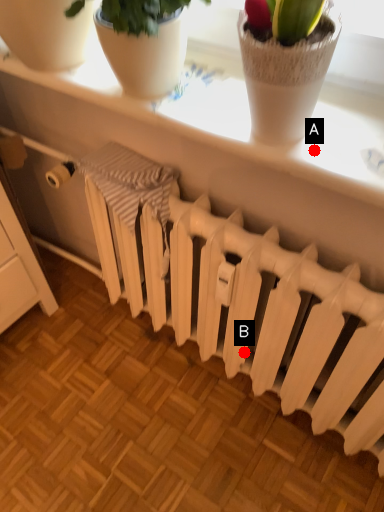
Question: Two points are circled on the image, labeled by A and B beside each circle. Which point appears farthest from the camera in this image?

Choices:
 (A) A is further
 (B) B is further

Answer: (B)